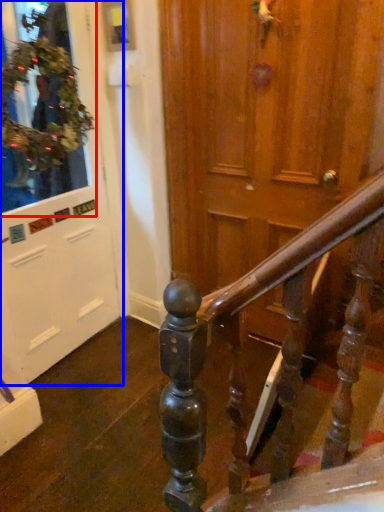
Question: Which of the following is the closest to the observer, shop window (highlighted by a red box) or door (highlighted by a blue box)?

Choices:
 (A) shop window
 (B) door

Answer: (B)